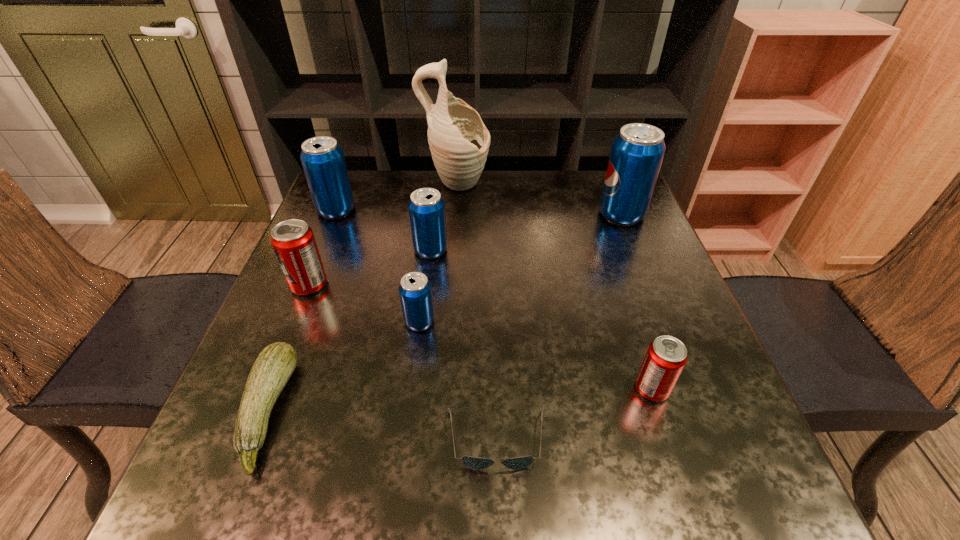
I want to click on object that is at the near left corner, so click(x=273, y=367).

I want to click on object positioned at the far right corner, so pos(637,152).

Find the location of a particular element. The height and width of the screenshot is (540, 960). free space at the far edge is located at coordinates tap(545, 192).

Where is `free spot at the near edge of the desktop`? The width and height of the screenshot is (960, 540). free spot at the near edge of the desktop is located at coordinates (429, 487).

Image resolution: width=960 pixels, height=540 pixels. In the image, there is a desktop. In order to click on free space at the left edge in this screenshot , I will do `click(304, 303)`.

I want to click on vacant point at the right edge, so click(616, 305).

The width and height of the screenshot is (960, 540). In order to click on vacant space at the far left corner of the desktop in this screenshot , I will do `click(379, 180)`.

In the image, there is a desktop. Where is `vacant space at the near left corner`? Image resolution: width=960 pixels, height=540 pixels. vacant space at the near left corner is located at coordinates (203, 472).

Locate an element on the screen. The width and height of the screenshot is (960, 540). vacant space at the far right corner is located at coordinates (598, 177).

This screenshot has width=960, height=540. In the image, there is a desktop. What are the coordinates of `blank space at the near right corner` in the screenshot? It's located at (705, 487).